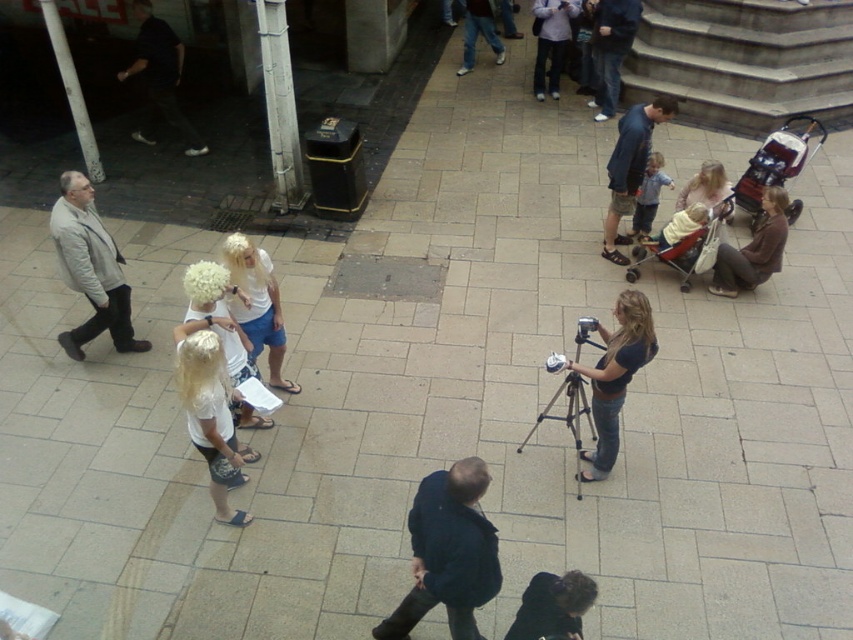
You are a photographer who wants to move from your current position to the camera in the scene. There is a light gray jacket at left in the way. Can you walk around it without getting too close? The minimum safe distance to maintain is 15 feet.

The light gray jacket at left and camera are 20.67 feet apart from each other. Since the minimum safe distance is 15 feet, you can walk around the light gray jacket at left and maintain the required distance.

You are standing at the camera position in the plaza. There are two points marked in the scene, one at coordinates point (136,339) and another at point (476,1). Which point is closer to your current position?

Point (136,339) is closer to the camera than point (476,1).